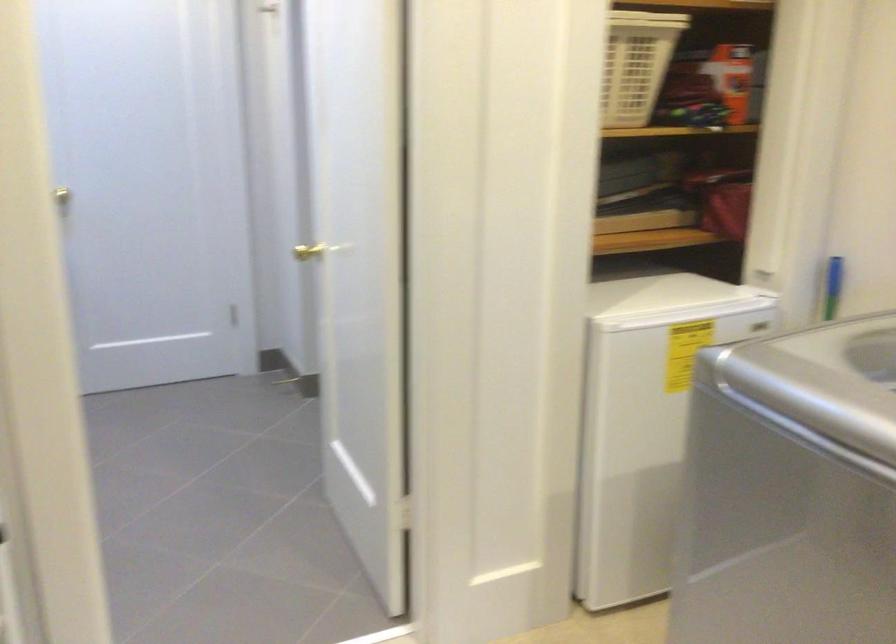
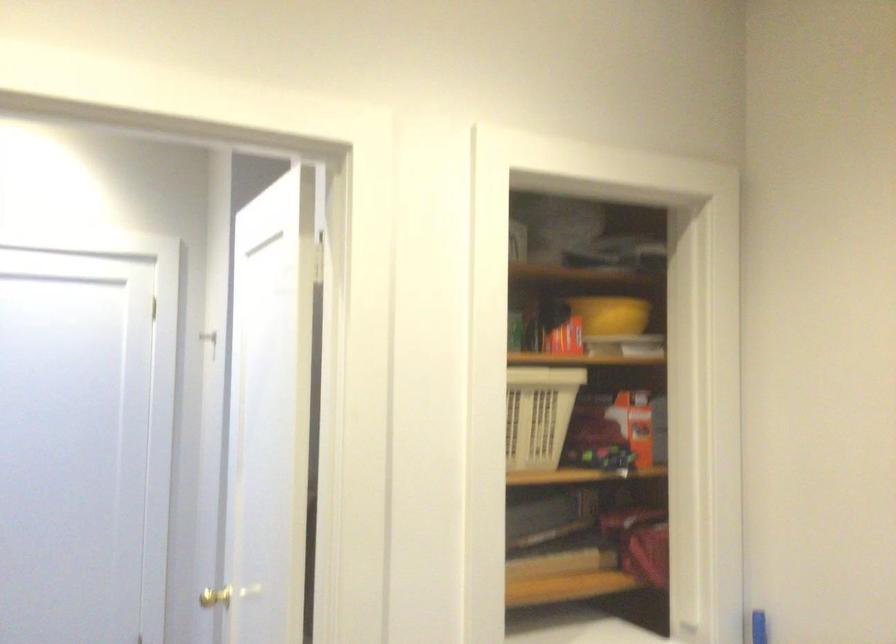
Question: The first image is from the beginning of the video and the second image is from the end. How did the camera likely rotate when shooting the video?

Choices:
 (A) Left
 (B) Right
 (C) Up
 (D) Down

Answer: (C)